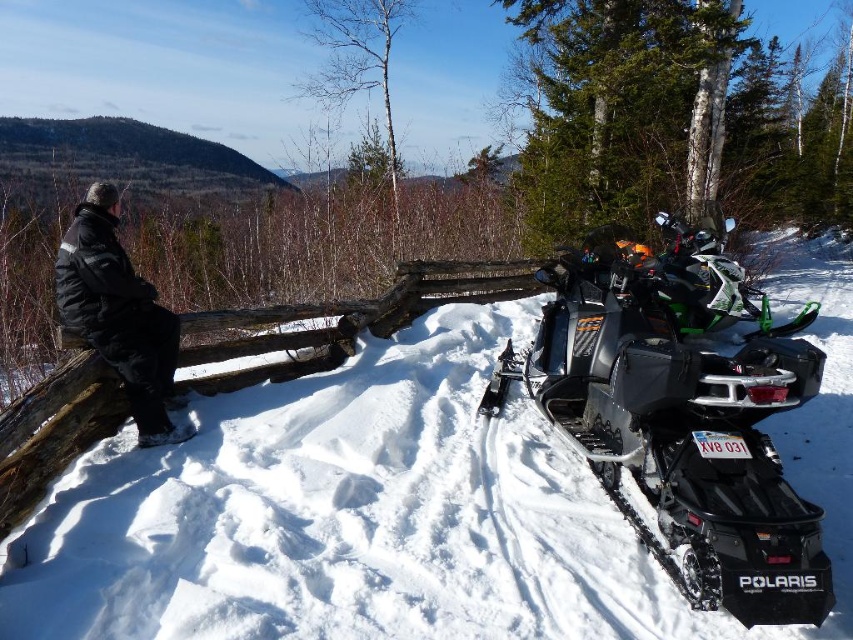
Is black matte snowmobile at right closer to camera compared to black puffy jacket at left?

Yes, black matte snowmobile at right is closer to the viewer.

Measure the distance from black matte snowmobile at right to black puffy jacket at left.

A distance of 3.52 meters exists between black matte snowmobile at right and black puffy jacket at left.

You are a GUI agent. You are given a task and a screenshot of the screen. Output one action in this format:
    pyautogui.click(x=<x>, y=<y>)
    Task: Click on the black matte snowmobile at right
    This screenshot has height=640, width=853.
    Given the screenshot: What is the action you would take?
    pyautogui.click(x=677, y=433)

Is white fluffy snow at center positioned before black matte snowmobile at right?

No, white fluffy snow at center is behind black matte snowmobile at right.

This screenshot has width=853, height=640. Identify the location of white fluffy snow at center. (355, 516).

Is white fluffy snow at center wider than black puffy jacket at left?

→ In fact, white fluffy snow at center might be narrower than black puffy jacket at left.

Can you confirm if white fluffy snow at center is thinner than black puffy jacket at left?

Correct, white fluffy snow at center's width is less than black puffy jacket at left's.

Which is in front, point (392, 609) or point (93, 266)?

Point (392, 609) is more forward.

Identify the location of white fluffy snow at center. (355, 516).